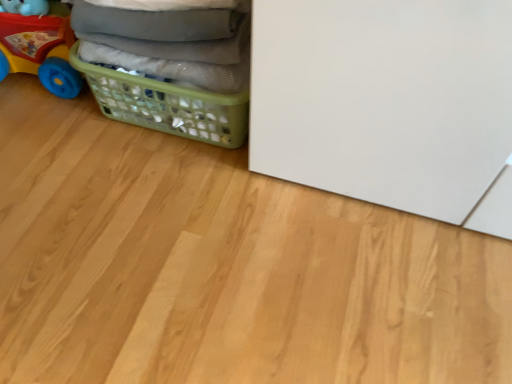
Question: Is plastic toy car at left further to the viewer compared to green plastic laundry basket at lower left?

Choices:
 (A) yes
 (B) no

Answer: (A)

Question: Could you tell me if plastic toy car at left is turned towards green plastic laundry basket at lower left?

Choices:
 (A) yes
 (B) no

Answer: (B)

Question: Would you consider plastic toy car at left to be distant from green plastic laundry basket at lower left?

Choices:
 (A) yes
 (B) no

Answer: (B)

Question: Is green plastic laundry basket at lower left located within plastic toy car at left?

Choices:
 (A) yes
 (B) no

Answer: (B)

Question: Is green plastic laundry basket at lower left at the back of plastic toy car at left?

Choices:
 (A) yes
 (B) no

Answer: (B)

Question: From the image's perspective, is plastic toy car at left beneath green plastic laundry basket at lower left?

Choices:
 (A) no
 (B) yes

Answer: (A)

Question: From the image's perspective, is green plastic laundry basket at lower left beneath plastic toy car at left?

Choices:
 (A) yes
 (B) no

Answer: (A)

Question: Is green plastic laundry basket at lower left at the left side of plastic toy car at left?

Choices:
 (A) yes
 (B) no

Answer: (B)

Question: Is the depth of green plastic laundry basket at lower left greater than that of plastic toy car at left?

Choices:
 (A) no
 (B) yes

Answer: (A)

Question: From a real-world perspective, is green plastic laundry basket at lower left beneath plastic toy car at left?

Choices:
 (A) yes
 (B) no

Answer: (A)

Question: Does green plastic laundry basket at lower left turn towards plastic toy car at left?

Choices:
 (A) yes
 (B) no

Answer: (B)

Question: Does green plastic laundry basket at lower left have a smaller size compared to plastic toy car at left?

Choices:
 (A) no
 (B) yes

Answer: (A)

Question: Choose the correct answer: Is plastic toy car at left inside green plastic laundry basket at lower left or outside it?

Choices:
 (A) inside
 (B) outside

Answer: (B)